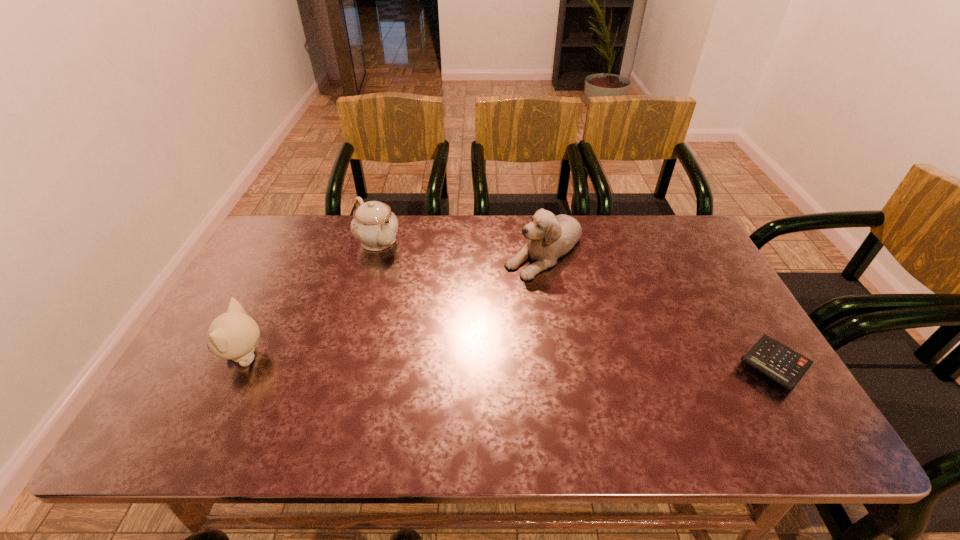
Where is `the leftmost object`? The width and height of the screenshot is (960, 540). the leftmost object is located at coordinates (233, 335).

Identify the location of calculator. (785, 366).

Find the location of a particular element. the rightmost object is located at coordinates (785, 366).

Locate an element on the screen. The width and height of the screenshot is (960, 540). the third object from left to right is located at coordinates (550, 237).

The width and height of the screenshot is (960, 540). Find the location of `chinaware`. chinaware is located at coordinates (374, 225).

The image size is (960, 540). What are the coordinates of `vacant space located 0.050m on the face of the kitten` in the screenshot? It's located at (203, 356).

The height and width of the screenshot is (540, 960). What are the coordinates of `free region located 0.160m on the left of the shortest object` in the screenshot? It's located at (669, 366).

Where is `free space located on the front-facing side of the third object from left to right`? free space located on the front-facing side of the third object from left to right is located at coordinates (452, 360).

Identify the location of vacant space situated on the front-facing side of the third object from left to right. Image resolution: width=960 pixels, height=540 pixels. (511, 292).

Locate an element on the screen. The height and width of the screenshot is (540, 960). free location located on the front-facing side of the third object from left to right is located at coordinates (457, 355).